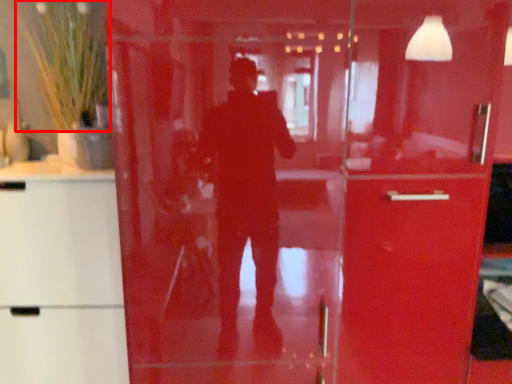
Question: In this image, where is plant (annotated by the red box) located relative to cabinetry?

Choices:
 (A) left
 (B) right

Answer: (B)